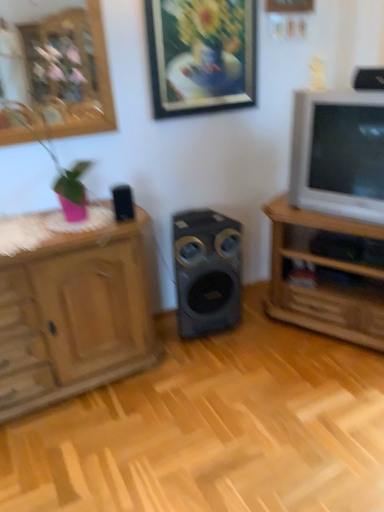
Question: Considering the relative positions of wooden cabinet at left and wooden tv stand at right in the image provided, is wooden cabinet at left to the right of wooden tv stand at right from the viewer's perspective?

Choices:
 (A) yes
 (B) no

Answer: (B)

Question: Can you confirm if wooden cabinet at left is thinner than wooden tv stand at right?

Choices:
 (A) no
 (B) yes

Answer: (B)

Question: Is wooden cabinet at left smaller than wooden tv stand at right?

Choices:
 (A) yes
 (B) no

Answer: (A)

Question: Are wooden cabinet at left and wooden tv stand at right making contact?

Choices:
 (A) no
 (B) yes

Answer: (A)

Question: Is wooden cabinet at left further to the viewer compared to wooden tv stand at right?

Choices:
 (A) no
 (B) yes

Answer: (A)

Question: Does wooden cabinet at left have a greater height compared to wooden tv stand at right?

Choices:
 (A) yes
 (B) no

Answer: (A)

Question: From a real-world perspective, does wooden cabinet at left sit lower than black plastic speaker at upper left, the second speaker viewed from the back?

Choices:
 (A) yes
 (B) no

Answer: (A)

Question: Is wooden cabinet at left located outside black plastic speaker at upper left, arranged as the 2th speaker when ordered from the bottom?

Choices:
 (A) no
 (B) yes

Answer: (B)

Question: Can you confirm if wooden cabinet at left is taller than black plastic speaker at upper left, acting as the 2th speaker starting from the front?

Choices:
 (A) yes
 (B) no

Answer: (A)

Question: Does wooden cabinet at left have a lesser width compared to black plastic speaker at upper left, acting as the second speaker starting from the top?

Choices:
 (A) yes
 (B) no

Answer: (B)

Question: Can you confirm if wooden cabinet at left is positioned to the left of black plastic speaker at upper left, arranged as the 2th speaker when ordered from the bottom?

Choices:
 (A) no
 (B) yes

Answer: (B)

Question: Does wooden cabinet at left have a smaller size compared to black plastic speaker at upper left, acting as the second speaker starting from the top?

Choices:
 (A) yes
 (B) no

Answer: (B)

Question: Is wooden tv stand at right wider than black plastic speaker at upper left, acting as the 2th speaker starting from the front?

Choices:
 (A) no
 (B) yes

Answer: (B)